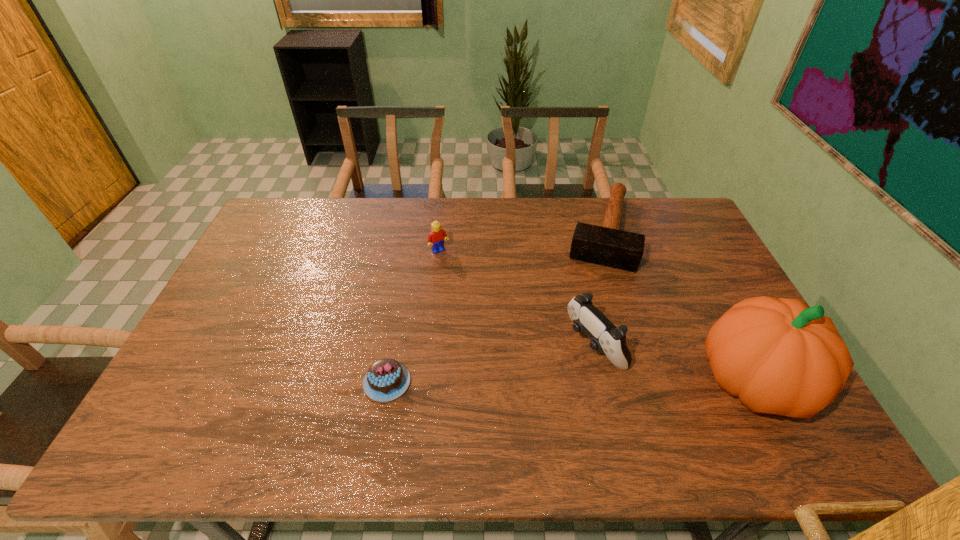
Identify the location of pumpkin that is at the near edge. (779, 356).

Identify the location of object that is positioned at the right edge. The image size is (960, 540). (779, 356).

Where is `object positioned at the near right corner`? This screenshot has width=960, height=540. object positioned at the near right corner is located at coordinates (779, 356).

Locate an element on the screen. The width and height of the screenshot is (960, 540). vacant space at the far edge of the desktop is located at coordinates (528, 199).

Image resolution: width=960 pixels, height=540 pixels. What are the coordinates of `free space at the near edge of the desktop` in the screenshot? It's located at (531, 393).

You are a GUI agent. You are given a task and a screenshot of the screen. Output one action in this format:
    pyautogui.click(x=<x>, y=<y>)
    Task: Click on the vacant space at the left edge of the desktop
    The width and height of the screenshot is (960, 540).
    Given the screenshot: What is the action you would take?
    pyautogui.click(x=265, y=279)

The height and width of the screenshot is (540, 960). In order to click on free space at the right edge of the desktop in this screenshot , I will do `click(688, 241)`.

Locate an element on the screen. empty space between the control and the fourth object from right to left is located at coordinates 516,298.

Image resolution: width=960 pixels, height=540 pixels. I want to click on vacant area that lies between the control and the third shortest object, so click(x=516, y=298).

You are a GUI agent. You are given a task and a screenshot of the screen. Output one action in this format:
    pyautogui.click(x=<x>, y=<y>)
    Task: Click on the empty space that is in between the chocolate cake and the tallest object
    The width and height of the screenshot is (960, 540).
    Given the screenshot: What is the action you would take?
    pyautogui.click(x=570, y=382)